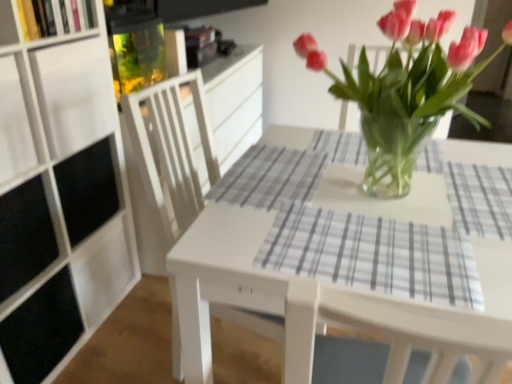
The width and height of the screenshot is (512, 384). In order to click on vacant area situated below pink glass vase at center (from a real-world perspective) in this screenshot , I will do `click(391, 195)`.